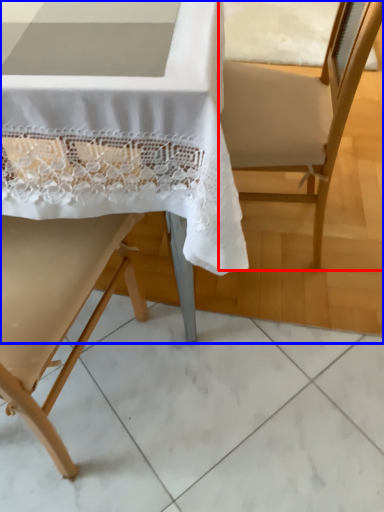
Question: Which object appears farthest to the camera in this image, armchair (highlighted by a red box) or chair (highlighted by a blue box)?

Choices:
 (A) armchair
 (B) chair

Answer: (A)